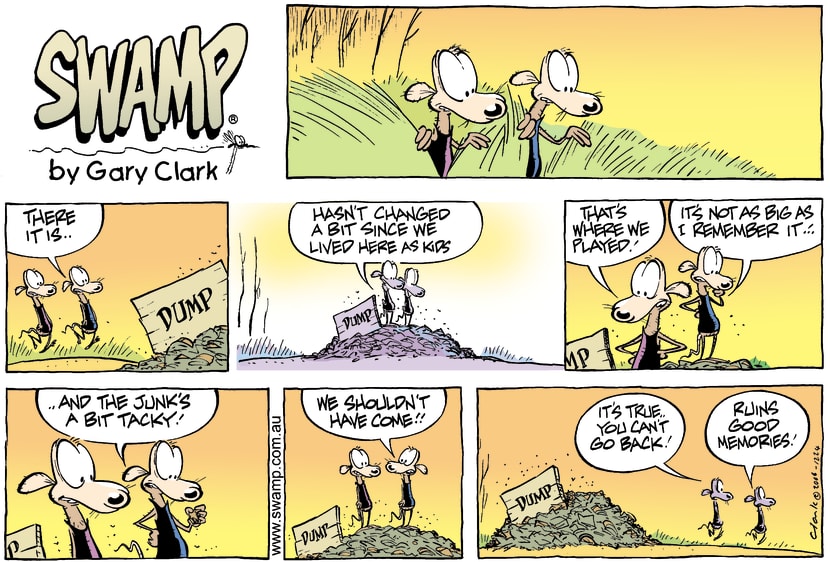
The height and width of the screenshot is (562, 830). What are the coordinates of `panels` in the screenshot? It's located at (392, 138), (139, 288), (266, 289), (642, 324), (212, 496), (338, 496), (501, 514).